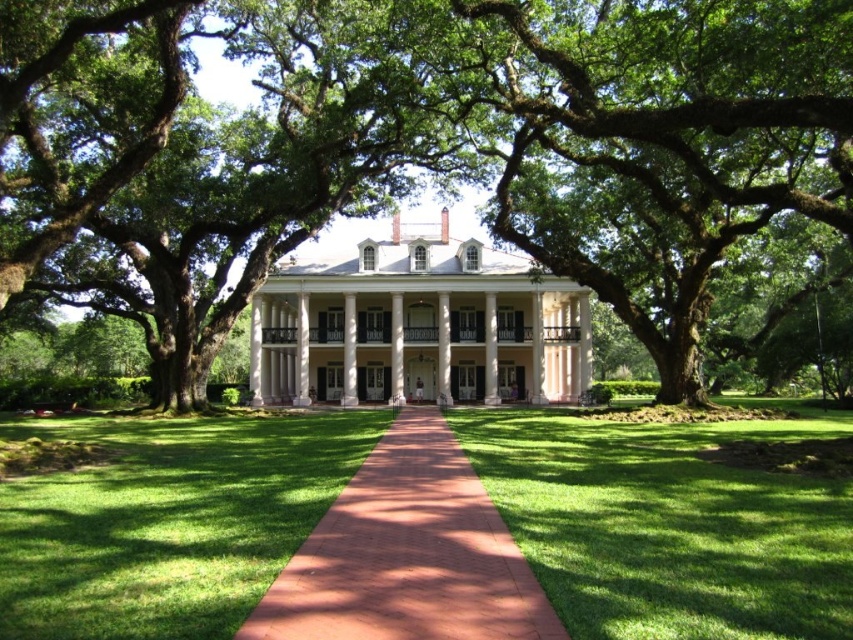
Is green leafy tree at center to the left of green grass at center from the viewer's perspective?

Correct, you'll find green leafy tree at center to the left of green grass at center.

Can you confirm if green leafy tree at center is bigger than green grass at center?

Correct, green leafy tree at center is larger in size than green grass at center.

Image resolution: width=853 pixels, height=640 pixels. What do you see at coordinates (471, 140) in the screenshot?
I see `green leafy tree at center` at bounding box center [471, 140].

Where is `green leafy tree at center`? The width and height of the screenshot is (853, 640). green leafy tree at center is located at coordinates (471, 140).

Measure the distance from green grass at center to red brick pathway at center.

They are 15.04 feet apart.

Who is lower down, green grass at center or red brick pathway at center?

green grass at center is lower down.

The height and width of the screenshot is (640, 853). Describe the element at coordinates (668, 524) in the screenshot. I see `green grass at center` at that location.

This screenshot has height=640, width=853. In order to click on green grass at center in this screenshot , I will do `click(668, 524)`.

Does green grass at center have a smaller size compared to white painted wood porch at center?

Actually, green grass at center might be larger than white painted wood porch at center.

Does green grass at center have a greater height compared to white painted wood porch at center?

No.

Who is more forward, (616, 467) or (454, 332)?

Point (616, 467)

Identify the location of green grass at center. This screenshot has width=853, height=640. (668, 524).